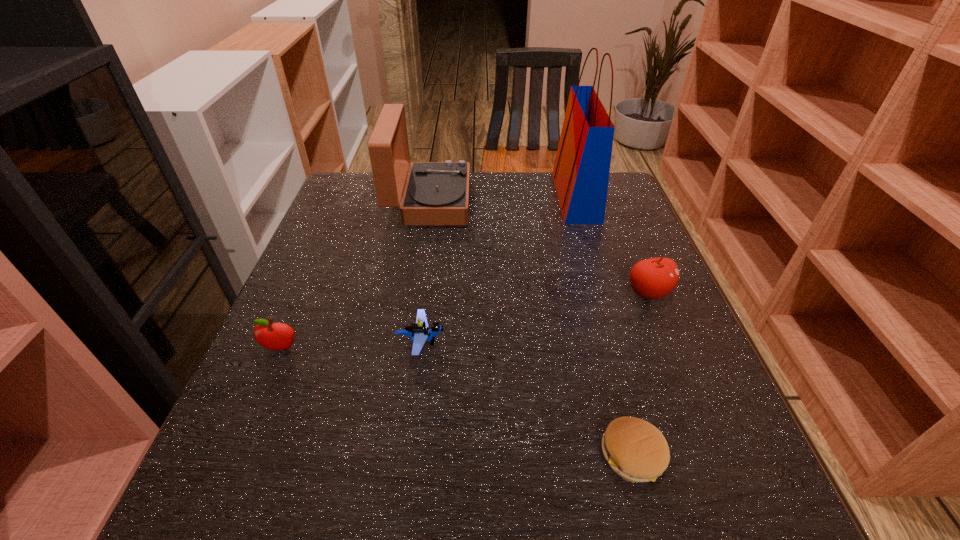
Where is `free point between the fifth tallest object and the shorter apple`? Image resolution: width=960 pixels, height=540 pixels. free point between the fifth tallest object and the shorter apple is located at coordinates (351, 346).

What are the coordinates of `empty space between the Lego and the shortest object` in the screenshot? It's located at (527, 399).

Where is `vacant area that lies between the right apple and the tallest object`? vacant area that lies between the right apple and the tallest object is located at coordinates (612, 245).

Where is `empty space between the shopping bag and the second tallest object`? empty space between the shopping bag and the second tallest object is located at coordinates (503, 200).

Where is `blank region between the phonograph record and the fifth tallest object`? The width and height of the screenshot is (960, 540). blank region between the phonograph record and the fifth tallest object is located at coordinates (425, 272).

What are the coordinates of `vacant space that's between the second tallest object and the right apple` in the screenshot? It's located at (540, 248).

Where is `free area in between the Lego and the right apple`? free area in between the Lego and the right apple is located at coordinates (535, 318).

The image size is (960, 540). Identify the location of vacant area that lies between the second tallest object and the shopping bag. (503, 200).

Locate an element on the screen. free spot between the left apple and the fourth nearest object is located at coordinates (465, 321).

You are a GUI agent. You are given a task and a screenshot of the screen. Output one action in this format:
    pyautogui.click(x=<x>, y=<y>)
    Task: Click on the empty space between the phonograph record and the nearest object
    
    Given the screenshot: What is the action you would take?
    pyautogui.click(x=531, y=329)